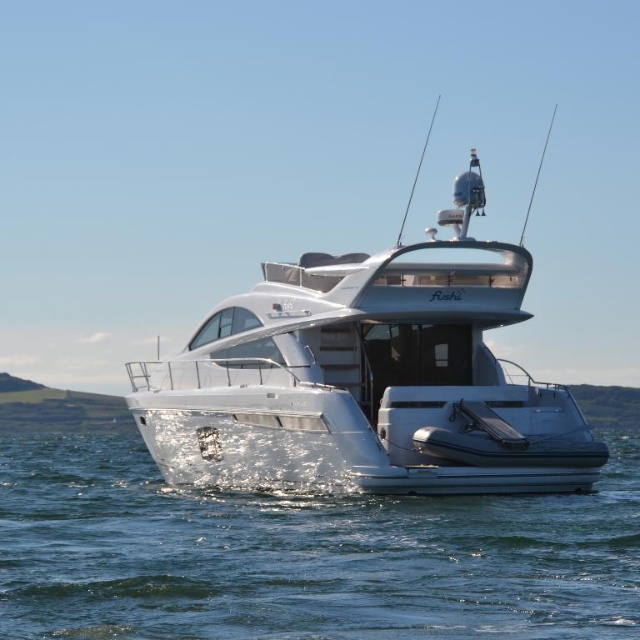
Between clear water at lower center and silver metallic boat at center, which one is positioned higher?

silver metallic boat at center is above.

Can you confirm if clear water at lower center is shorter than silver metallic boat at center?

Yes, clear water at lower center is shorter than silver metallic boat at center.

The width and height of the screenshot is (640, 640). What are the coordinates of `clear water at lower center` in the screenshot? It's located at (301, 554).